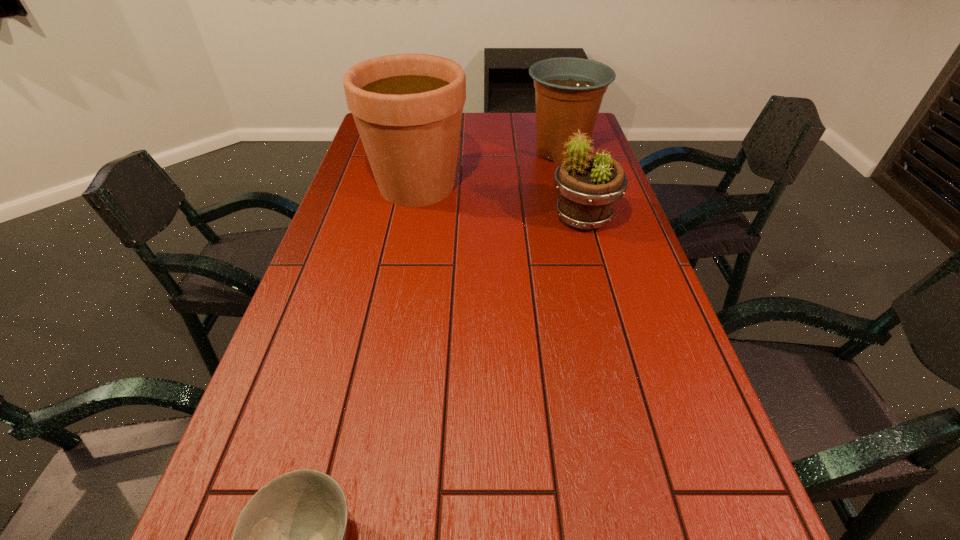
Identify which object is the nearest to the tallest flowerpot. Please provide its 2D coordinates. Your answer should be formatted as a tuple, i.e. [(x, y)], where the tuple contains the x and y coordinates of a point satisfying the conditions above.

[(568, 91)]

Locate an element on the screen. The height and width of the screenshot is (540, 960). flowerpot that is the closest to the leftmost flowerpot is located at coordinates (568, 91).

Identify the location of the second closest flowerpot to the tallest flowerpot. The height and width of the screenshot is (540, 960). (588, 187).